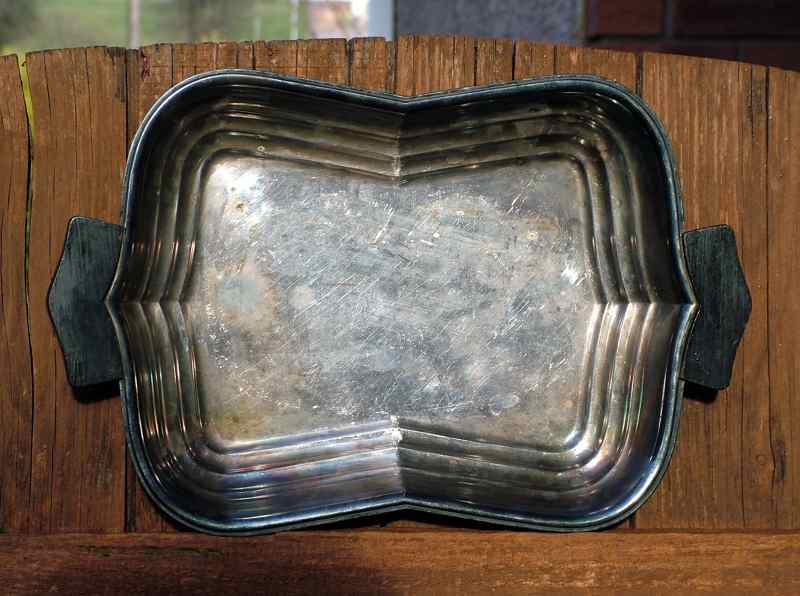
The image size is (800, 596). What are the coordinates of `handle` in the screenshot? It's located at (100, 384).